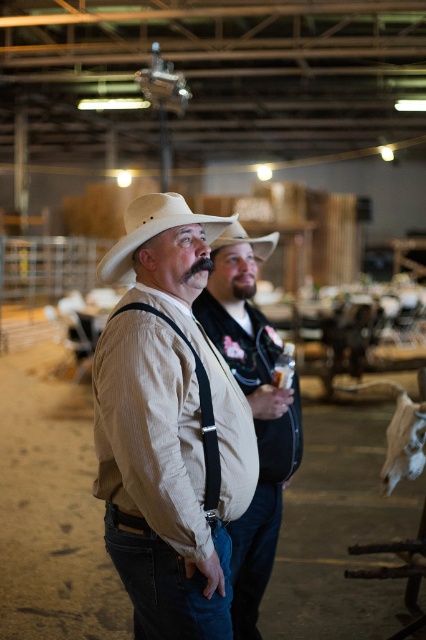
You are at a social event and need to identify which object is bigger between the matte beige shirt at center and the beige felt cowboy hat at center. Based on the scene description, which one is larger?

The matte beige shirt at center is larger in size than the beige felt cowboy hat at center.

You are organizing a costume party and need to ensure all items fit in a rectangular box that can only accommodate items up to the width of the matte beige shirt at center. Can the beige felt cowboy hat at center fit inside this box?

The matte beige shirt at center is narrower than the beige felt cowboy hat at center. Since the box can only fit items up to the width of the matte beige shirt at center, the beige felt cowboy hat at center is wider and therefore cannot fit inside the box.